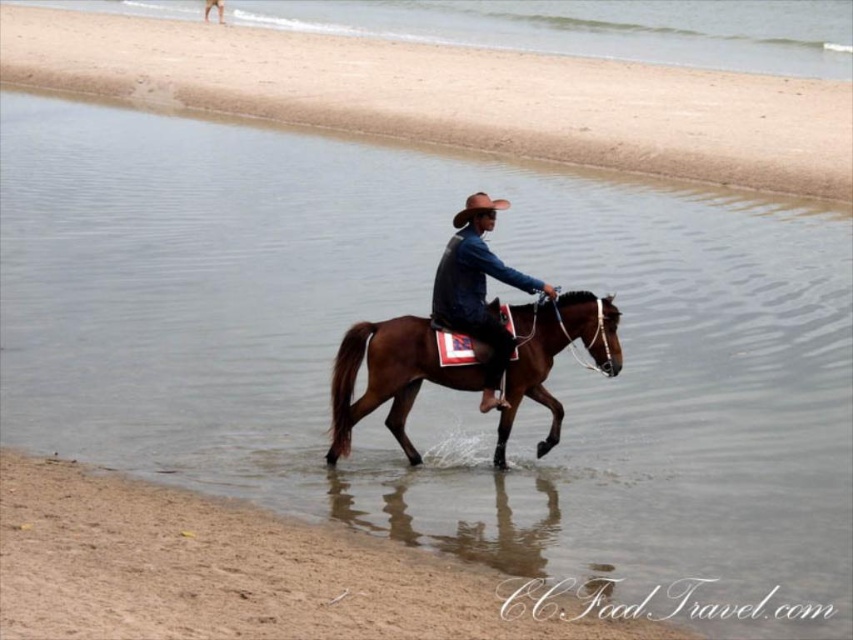
Is sandy beach at lower center positioned before shiny brown leather cowboy hat at center?

That is False.

Is sandy beach at lower center above shiny brown leather cowboy hat at center?

Yes, sandy beach at lower center is above shiny brown leather cowboy hat at center.

Where is `sandy beach at lower center`? sandy beach at lower center is located at coordinates (453, 97).

Is brown sandy beach at lower left wider than brown leather cowboy hat at center?

No, brown sandy beach at lower left is not wider than brown leather cowboy hat at center.

How much distance is there between brown sandy beach at lower left and brown leather cowboy hat at center?

6.98 meters

The image size is (853, 640). What do you see at coordinates (230, 570) in the screenshot? I see `brown sandy beach at lower left` at bounding box center [230, 570].

You are a GUI agent. You are given a task and a screenshot of the screen. Output one action in this format:
    pyautogui.click(x=<x>, y=<y>)
    Task: Click on the brown sandy beach at lower left
    Image resolution: width=853 pixels, height=640 pixels.
    Given the screenshot: What is the action you would take?
    pyautogui.click(x=230, y=570)

Does sandy beach at lower center appear on the right side of brown leather cowboy hat at center?

In fact, sandy beach at lower center is to the left of brown leather cowboy hat at center.

Can you confirm if sandy beach at lower center is wider than brown leather cowboy hat at center?

Yes.

Who is more distant from viewer, (49, 12) or (468, 214)?

The point (49, 12) is more distant.

Find the location of `sandy beach at lower center`. sandy beach at lower center is located at coordinates (453, 97).